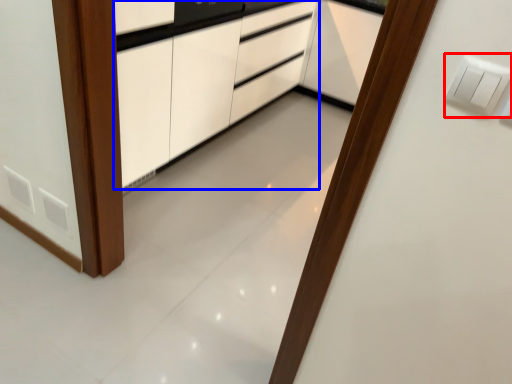
Question: Which point is closer to the camera, light switch (highlighted by a red box) or cabinetry (highlighted by a blue box)?

Choices:
 (A) light switch
 (B) cabinetry

Answer: (A)